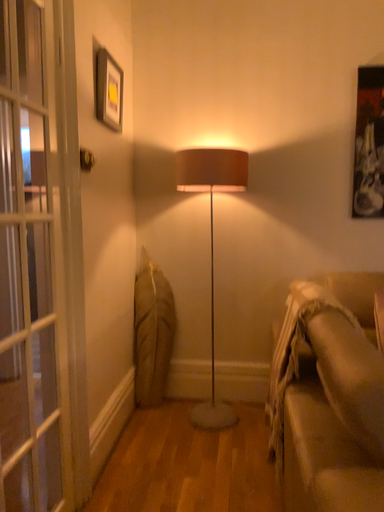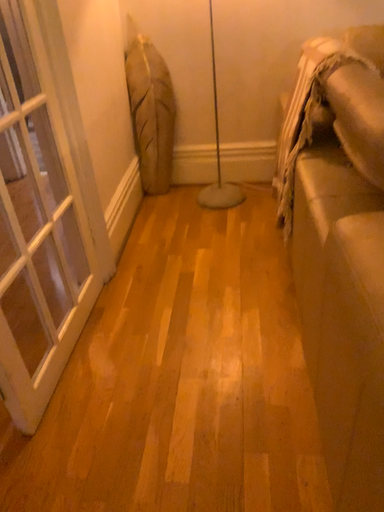
Question: Which way did the camera rotate in the video?

Choices:
 (A) rotated downward
 (B) rotated upward

Answer: (A)